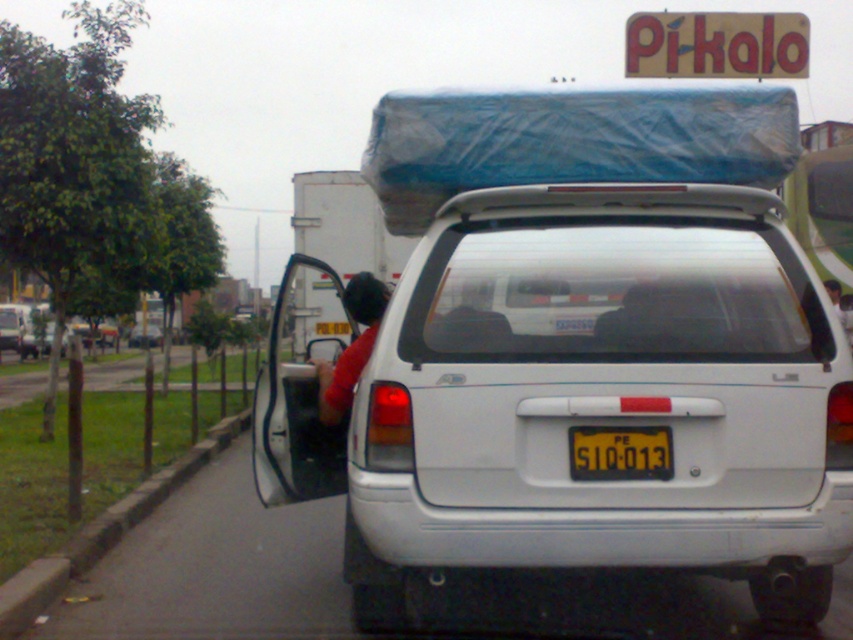
Question: Is white matte truck at center bigger than white matte van at center?

Choices:
 (A) no
 (B) yes

Answer: (B)

Question: Which object is closer to the camera taking this photo?

Choices:
 (A) white matte van at center
 (B) yellowtexturedlicense plate at center
 (C) gray concrete curb at lower left

Answer: (B)

Question: Which point is closer to the camera taking this photo?

Choices:
 (A) (154, 346)
 (B) (656, 465)

Answer: (B)

Question: Does white matte truck at center appear over white matte van at center?

Choices:
 (A) yes
 (B) no

Answer: (A)

Question: Which object is the farthest from the yellowtexturedlicense plate at center?

Choices:
 (A) white matte van at center
 (B) white matte truck at center

Answer: (A)

Question: Does gray concrete curb at lower left have a larger size compared to yellowtexturedlicense plate at center?

Choices:
 (A) no
 (B) yes

Answer: (B)